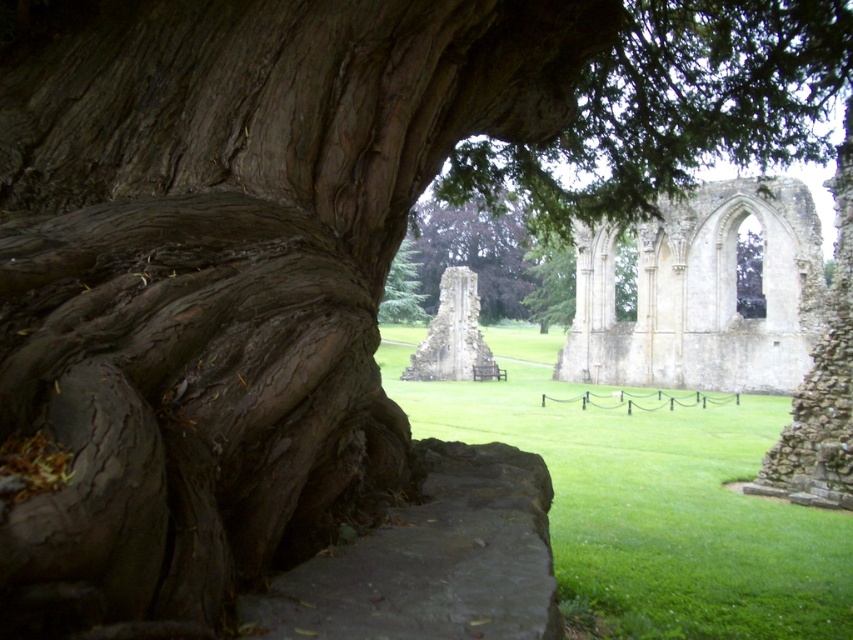
You are a landscape architect planning to plant a new tree between the brown rough bark at left and the green leafy tree at center. The new tree requires a minimum of 50 meters of space between it and any existing trees. Can you plant the new tree in this location without violating the spacing requirement?

The brown rough bark at left and green leafy tree at center are 51.87 meters apart from each other. Since the required minimum spacing is 50 meters, planting a new tree between them would violate the spacing requirement because the existing trees are only 51.87 meters apart, which is just slightly above the minimum. However, the exact placement would depend on the new tree being positioned such that it maintains at least 50 meters from both existing trees. Given the total distance is 51.87 meters, the new

Consider the image. You are standing at the base of the large gnarled tree trunk in the foreground of the ruins scene. You notice two points marked in the image, point A at coordinates point (693, 282) and point B at coordinates point (415, 292). Which point is closer to you?

Point A at coordinates point (693, 282) is closer to you because it is in front of point B at coordinates point (415, 292).